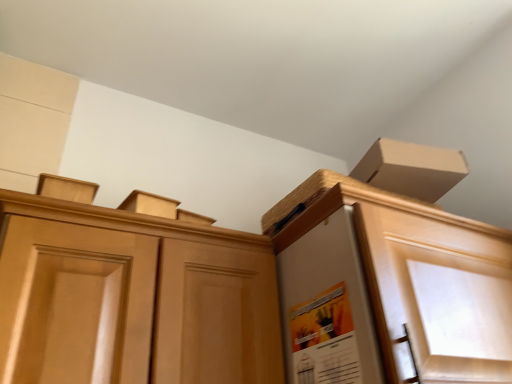
Question: Considering the positions of matte orange poster at center and light brown wood cabinet at center in the image, is matte orange poster at center taller or shorter than light brown wood cabinet at center?

Choices:
 (A) tall
 (B) short

Answer: (B)

Question: Considering the positions of matte orange poster at center and light brown wood cabinet at center in the image, is matte orange poster at center bigger or smaller than light brown wood cabinet at center?

Choices:
 (A) small
 (B) big

Answer: (A)

Question: From a real-world perspective, is matte orange poster at center above or below light brown wood cabinet at center?

Choices:
 (A) above
 (B) below

Answer: (B)

Question: From their relative heights in the image, would you say light brown wood cabinet at center is taller or shorter than matte orange poster at center?

Choices:
 (A) short
 (B) tall

Answer: (B)

Question: From a real-world perspective, is light brown wood cabinet at center positioned above or below matte orange poster at center?

Choices:
 (A) above
 (B) below

Answer: (A)

Question: Is light brown wood cabinet at center inside the boundaries of matte orange poster at center, or outside?

Choices:
 (A) inside
 (B) outside

Answer: (B)

Question: Does point (89, 213) appear closer or farther from the camera than point (337, 382)?

Choices:
 (A) closer
 (B) farther

Answer: (B)